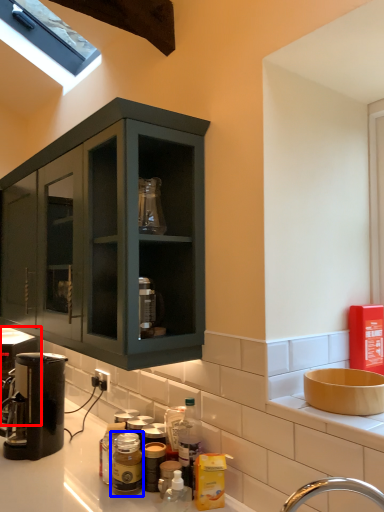
Question: Which object appears farthest to the camera in this image, coffee machine (highlighted by a red box) or bottle (highlighted by a blue box)?

Choices:
 (A) coffee machine
 (B) bottle

Answer: (A)